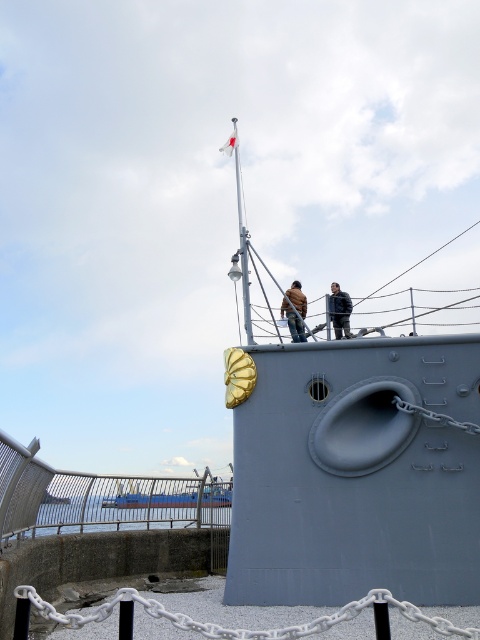
You are standing on the deck of the ship and want to move from your current position near the flagpole to the blue painted metal boat at lower center. Which direction should you move relative to the brown leather jacket at upper center?

You should move to the left of the brown leather jacket at upper center to reach the blue painted metal boat at lower center because the blue painted metal boat at lower center is located to the left of the brown leather jacket at upper center.

You are a tour guide on the ship and need to direct visitors to the lower observation deck. Which of the two jackets, the brown leather jacket at upper center or the dark blue leather jacket at upper center, is positioned lower and closer to the deck floor?

The brown leather jacket at upper center is positioned below the dark blue leather jacket at upper center, so it is closer to the deck floor.